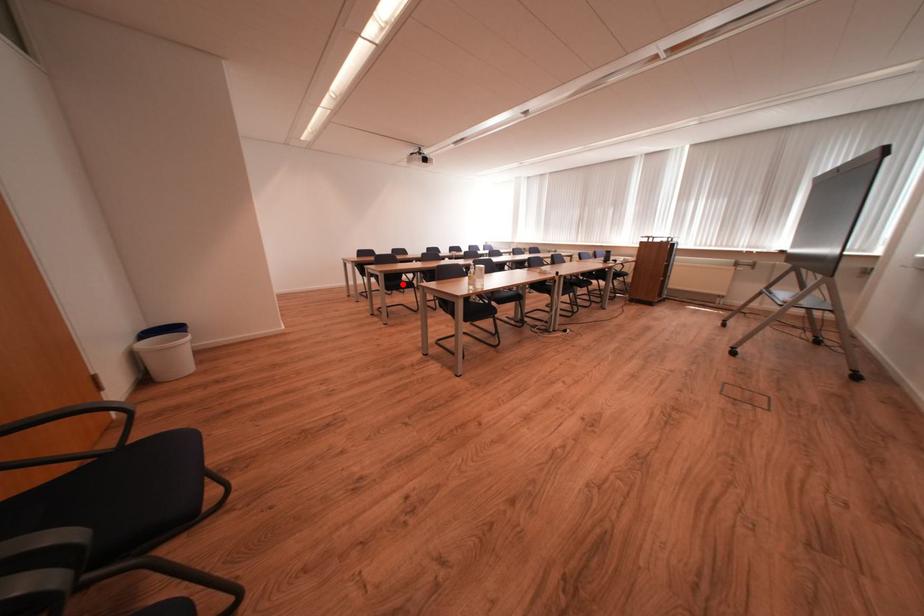
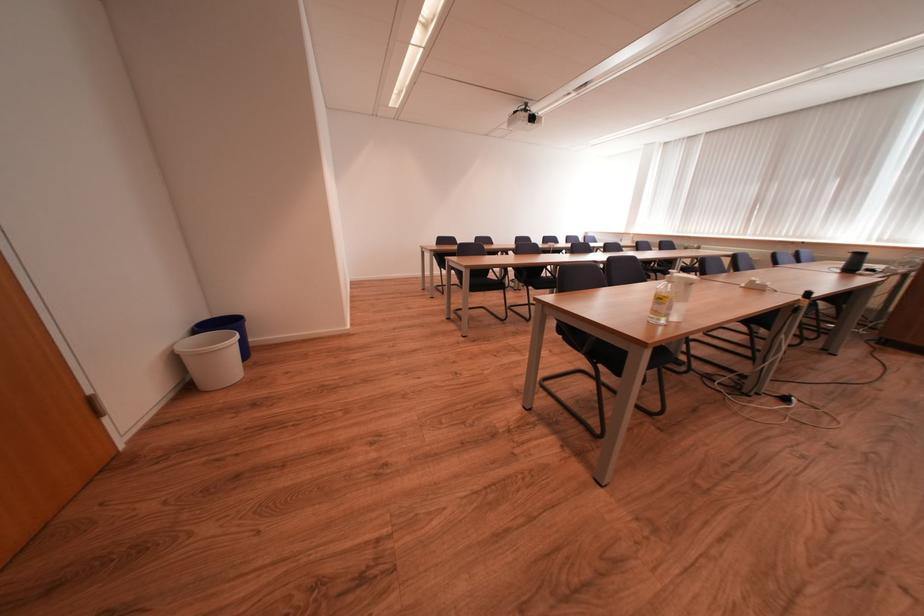
Question: I am providing you with two images of the same scene from different viewpoints. Image1 has a red point marked. In image2, the corresponding 3D location appears at what relative position? Reply with the corresponding letter.

Choices:
 (A) Closer
 (B) Farther

Answer: (B)